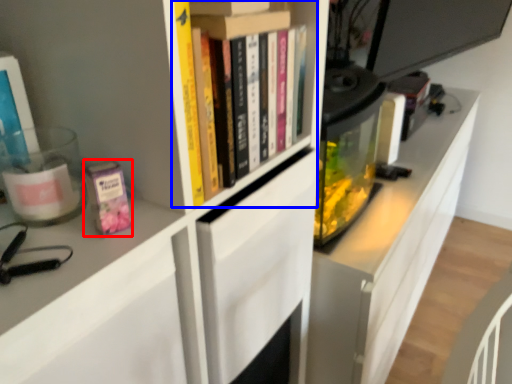
Question: Which object is closer to the camera taking this photo, paperback book (highlighted by a red box) or book (highlighted by a blue box)?

Choices:
 (A) paperback book
 (B) book

Answer: (A)